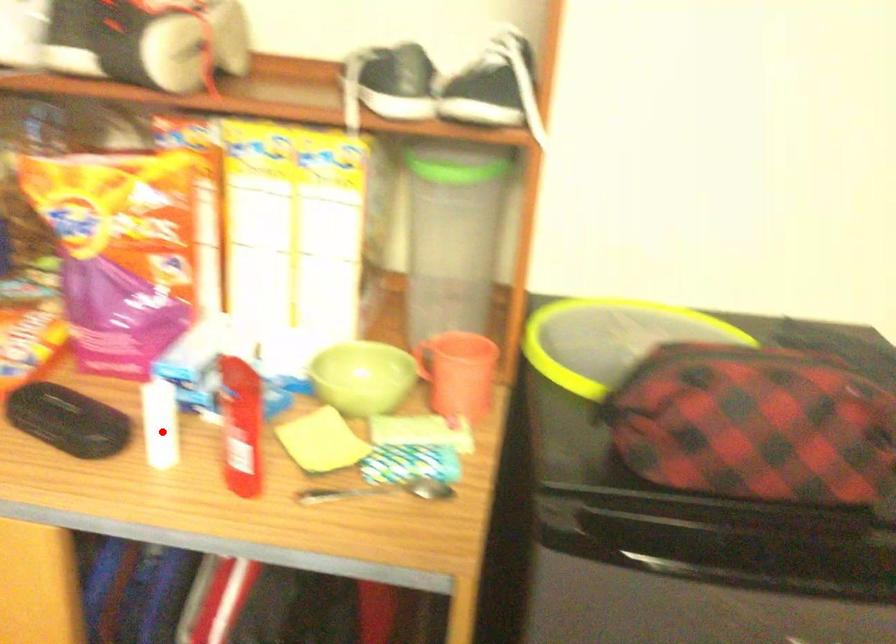
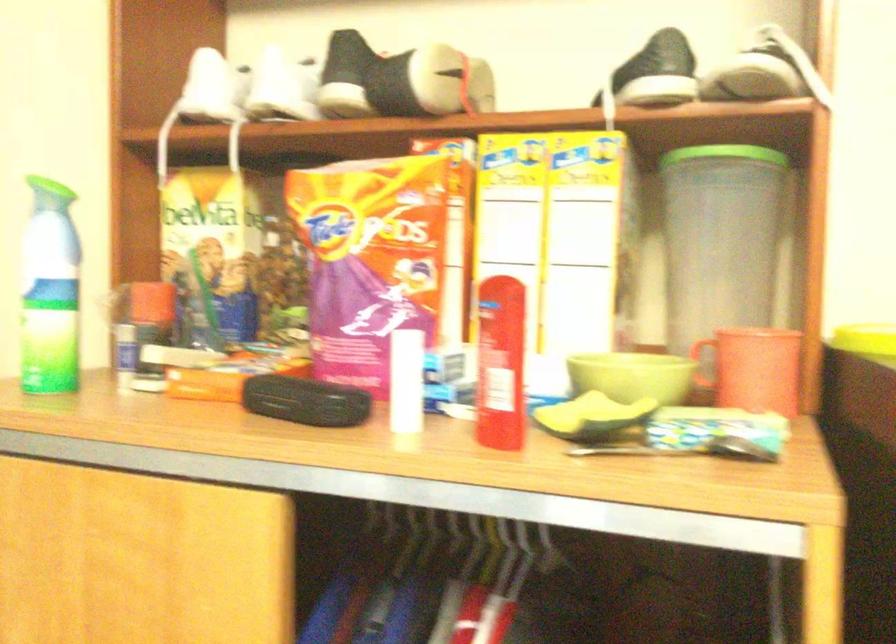
Question: I am providing you with two images of the same scene from different viewpoints. Given a red point in image1, look at the same physical point in image2. Is it:

Choices:
 (A) Closer to the viewpoint
 (B) Farther from the viewpoint

Answer: (A)